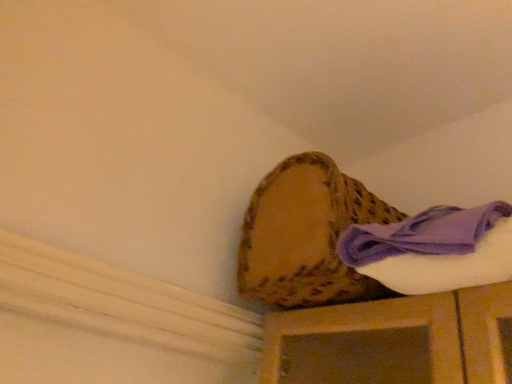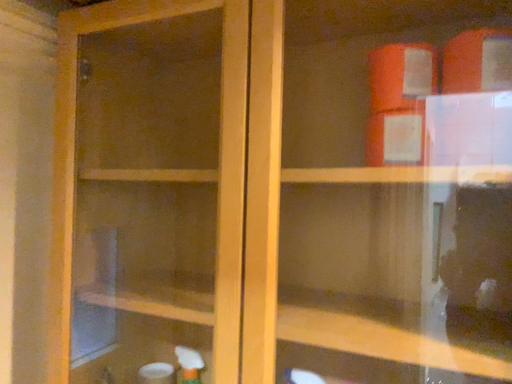
Question: Which way did the camera rotate in the video?

Choices:
 (A) rotated downward
 (B) rotated upward

Answer: (A)